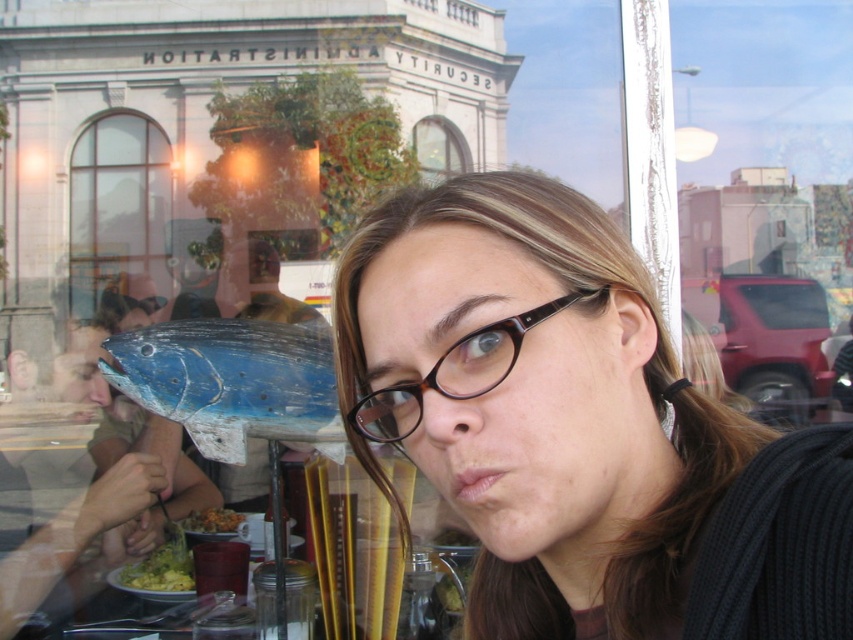
Question: Which point is closer to the camera?

Choices:
 (A) matte black glasses at center
 (B) green matte pasta at lower left
 (C) clear glass window at upper left

Answer: (A)

Question: Which of the following is the farthest from the observer?

Choices:
 (A) (444, 134)
 (B) (141, 253)
 (C) (242, 403)
 (D) (190, 579)

Answer: (A)

Question: Does green leafy salad at lower left have a larger size compared to green matte pasta at lower left?

Choices:
 (A) yes
 (B) no

Answer: (A)

Question: Is clear glass window at upper left thinner than brown acetate glasses at center?

Choices:
 (A) no
 (B) yes

Answer: (B)

Question: Which point is closer to the camera taking this photo?

Choices:
 (A) (190, 516)
 (B) (273, 324)
 (C) (108, 179)
 (D) (440, 150)

Answer: (B)

Question: Is brown acetate glasses at center thinner than green matte pasta at lower left?

Choices:
 (A) yes
 (B) no

Answer: (B)